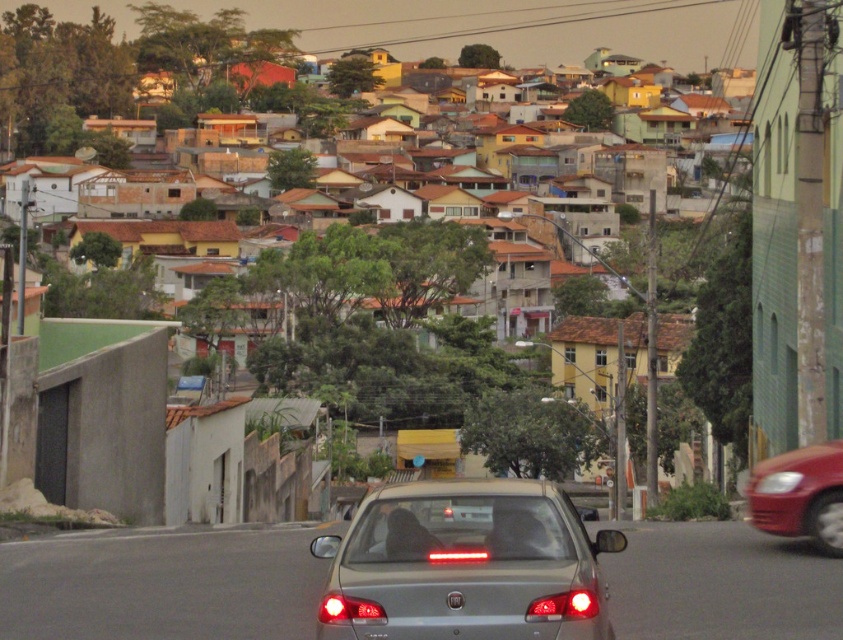
Is satin silver sedan at center behind shiny red car at right?

No, it is not.

The width and height of the screenshot is (843, 640). What do you see at coordinates (465, 564) in the screenshot? I see `satin silver sedan at center` at bounding box center [465, 564].

Who is more distant from viewer, (368, 557) or (756, 515)?

Positioned behind is point (756, 515).

I want to click on satin silver sedan at center, so click(465, 564).

Is brown corrugated metal houses at upper center positioned before shiny red car at right?

No, brown corrugated metal houses at upper center is further to the viewer.

Is point (19, 19) more distant than point (835, 525)?

Yes, point (19, 19) is farther from viewer.

Locate an element on the screen. The image size is (843, 640). brown corrugated metal houses at upper center is located at coordinates (106, 76).

Which is behind, point (481, 529) or point (90, 77)?

The point (90, 77) is behind.

Looking at this image, does satin silver sedan at center have a lesser width compared to brown corrugated metal houses at upper center?

Yes.

You are a GUI agent. You are given a task and a screenshot of the screen. Output one action in this format:
    pyautogui.click(x=<x>, y=<y>)
    Task: Click on the satin silver sedan at center
    This screenshot has height=640, width=843.
    Given the screenshot: What is the action you would take?
    pyautogui.click(x=465, y=564)